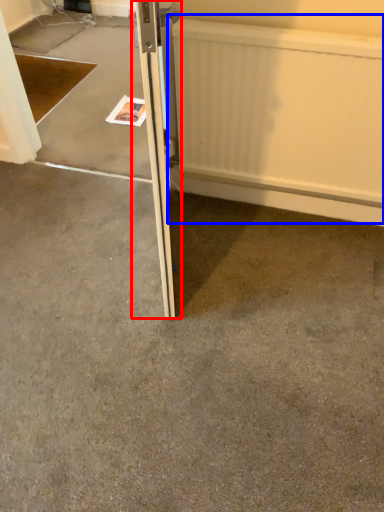
Question: Which of the following is the farthest to the observer, door (highlighted by a red box) or radiator (highlighted by a blue box)?

Choices:
 (A) door
 (B) radiator

Answer: (B)